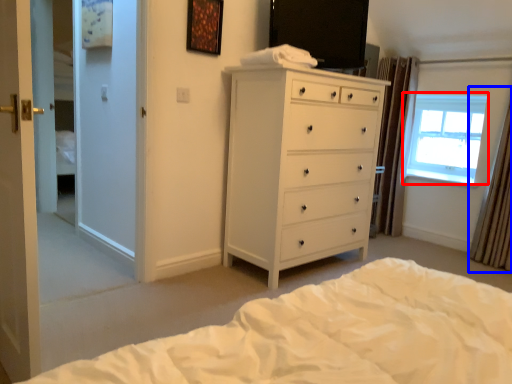
Question: Which object appears farthest to the camera in this image, window (highlighted by a red box) or curtain (highlighted by a blue box)?

Choices:
 (A) window
 (B) curtain

Answer: (A)